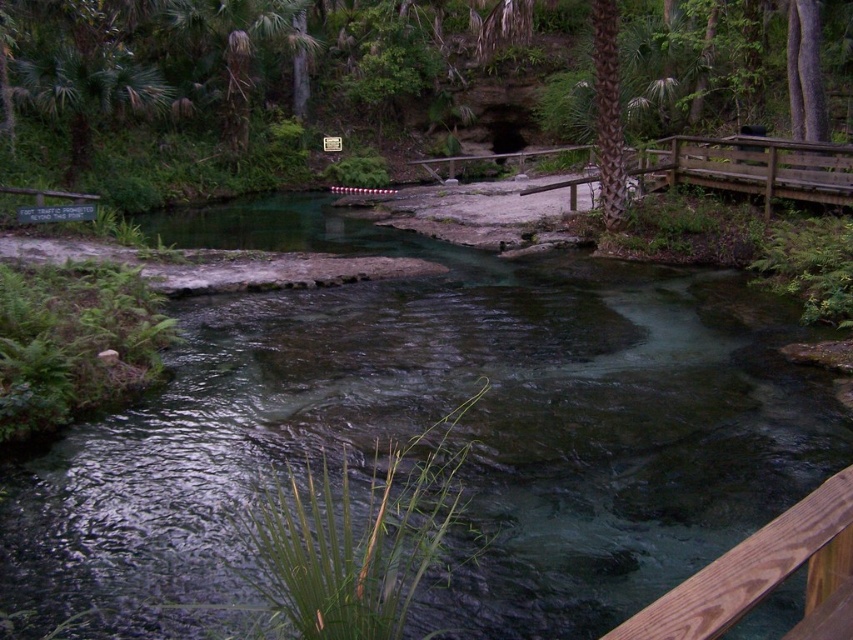
Question: Which point is farther from the camera taking this photo?

Choices:
 (A) (608, 196)
 (B) (815, 614)
 (C) (775, 628)

Answer: (A)

Question: Does clear water stream at center have a greater width compared to brown textured palm tree at upper center?

Choices:
 (A) yes
 (B) no

Answer: (A)

Question: Which point is closer to the camera?

Choices:
 (A) brown textured palm tree at upper center
 (B) clear water stream at center
 (C) brown wood rail at lower right

Answer: (C)

Question: Which point is closer to the camera?

Choices:
 (A) brown wood rail at lower right
 (B) brown textured palm tree at upper center

Answer: (A)

Question: Considering the relative positions of brown wood rail at lower right and brown textured palm tree at upper center in the image provided, where is brown wood rail at lower right located with respect to brown textured palm tree at upper center?

Choices:
 (A) above
 (B) below

Answer: (B)

Question: Does clear water stream at center have a smaller size compared to brown wood rail at lower right?

Choices:
 (A) no
 (B) yes

Answer: (A)